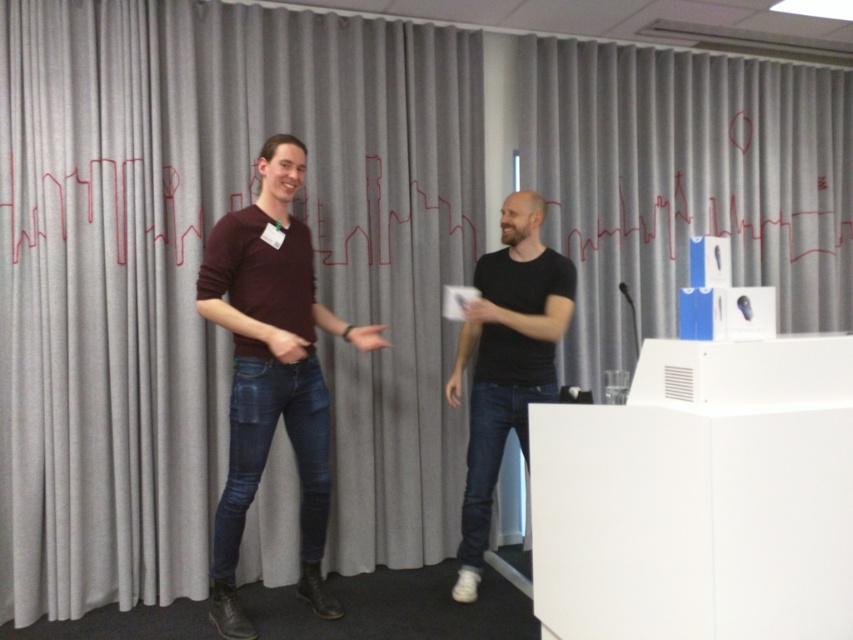
Which is in front, point (647, 177) or point (71, 184)?

Point (71, 184)

Is point (550, 36) farther from viewer compared to point (318, 230)?

Yes.

Between point (778, 243) and point (173, 228), which one is positioned in front?

Positioned in front is point (173, 228).

Locate an element on the screen. gray fabric curtain at upper center is located at coordinates (683, 182).

Does point (512, 371) come behind point (456, 301)?

Yes.

Does black matte shirt at right have a lesser height compared to white matte wii controller at center?

No.

Image resolution: width=853 pixels, height=640 pixels. What are the coordinates of `black matte shirt at right` in the screenshot? It's located at (506, 362).

The image size is (853, 640). Identify the location of black matte shirt at right. (506, 362).

Does point (619, 154) come farther from viewer compared to point (288, 387)?

That is True.

Is the position of gray fabric curtain at upper center more distant than that of maroon sweater at center?

Yes, gray fabric curtain at upper center is behind maroon sweater at center.

You are a GUI agent. You are given a task and a screenshot of the screen. Output one action in this format:
    pyautogui.click(x=<x>, y=<y>)
    Task: Click on the gray fabric curtain at upper center
    This screenshot has height=640, width=853.
    Given the screenshot: What is the action you would take?
    pyautogui.click(x=683, y=182)